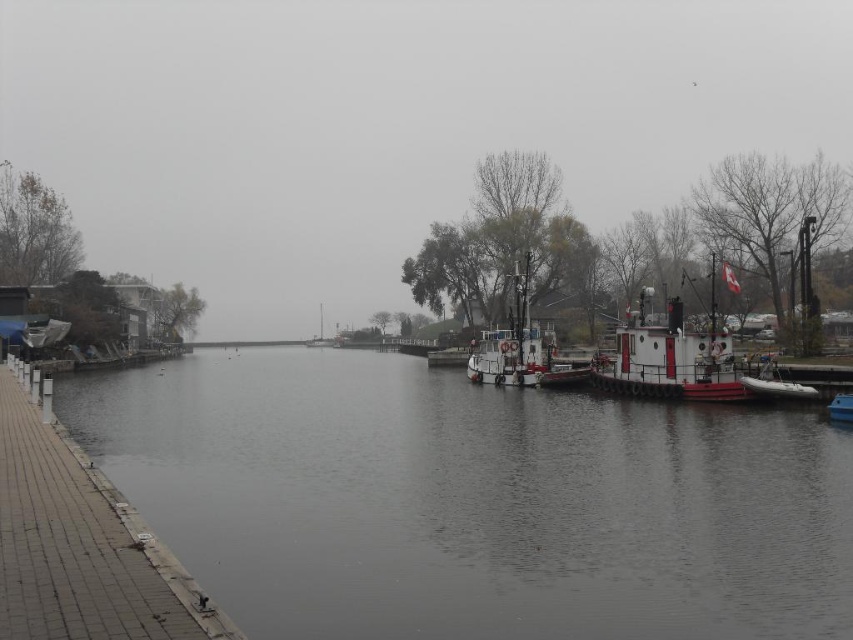
You are standing at the point marked as point (x=79, y=545) in the image. What object is located exactly at this point?

The gray concrete dock at lower left is located exactly at point (x=79, y=545).

You are standing on the walkway on the left side of the image and want to cross to the other side. The dark gray water at center and the white matte tugboat at right are in your path. Which one is wider so you can choose the better route?

The dark gray water at center is wider than the white matte tugboat at right, so you should choose the route through the dark gray water at center because it is wider.

You are standing on the gray concrete dock at lower left and want to move to the white matte tugboat at center. Since the dock is wider than the tugboat, will you have enough space to walk from the dock to the tugboat?

The gray concrete dock at lower left is wider than the white matte tugboat at center, so yes, you will have enough space to walk from the gray concrete dock at lower left to the white matte tugboat at center since the dock provides a wider platform.